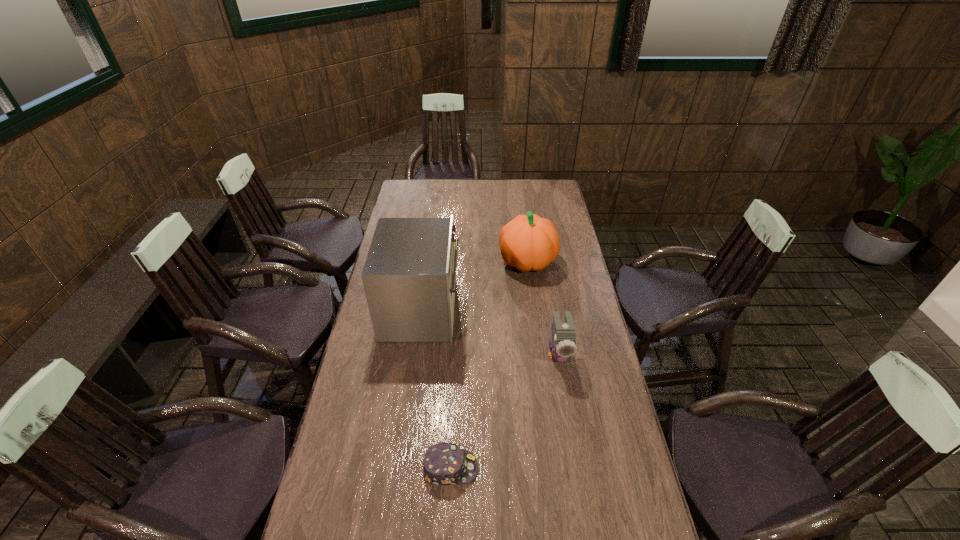
I want to click on object present at the left edge, so click(x=409, y=276).

The width and height of the screenshot is (960, 540). In order to click on pumpkin that is positioned at the right edge in this screenshot , I will do `click(528, 242)`.

In order to click on bird at the right edge in this screenshot , I will do `click(563, 345)`.

Image resolution: width=960 pixels, height=540 pixels. I want to click on vacant space at the far edge of the desktop, so click(483, 199).

Image resolution: width=960 pixels, height=540 pixels. In the image, there is a desktop. In order to click on vacant area at the left edge in this screenshot , I will do `click(362, 330)`.

At what (x,y) coordinates should I click in order to perform the action: click on vacant space at the right edge of the desktop. Please return your answer as a coordinate pair (x, y). The image size is (960, 540). Looking at the image, I should click on (639, 489).

In the image, there is a desktop. Where is `vacant space at the far left corner`? The height and width of the screenshot is (540, 960). vacant space at the far left corner is located at coordinates (412, 194).

The image size is (960, 540). What are the coordinates of `free region at the far right corner of the desktop` in the screenshot? It's located at (538, 198).

The width and height of the screenshot is (960, 540). I want to click on empty space that is in between the headwear and the tallest object, so click(x=436, y=389).

In order to click on free spot between the pumpkin and the headwear in this screenshot , I will do pyautogui.click(x=489, y=365).